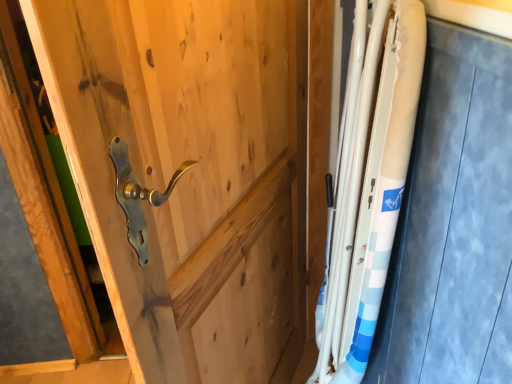
Question: From the image's perspective, would you say white glossy steel at right is positioned over natural wood door handle at center?

Choices:
 (A) yes
 (B) no

Answer: (A)

Question: Is the depth of white glossy steel at right greater than that of natural wood door handle at center?

Choices:
 (A) no
 (B) yes

Answer: (B)

Question: From a real-world perspective, is white glossy steel at right beneath natural wood door handle at center?

Choices:
 (A) no
 (B) yes

Answer: (A)

Question: Does white glossy steel at right have a lesser width compared to natural wood door handle at center?

Choices:
 (A) no
 (B) yes

Answer: (A)

Question: Can you confirm if white glossy steel at right is taller than natural wood door handle at center?

Choices:
 (A) no
 (B) yes

Answer: (A)

Question: Is white glossy steel at right wider than natural wood door handle at center?

Choices:
 (A) yes
 (B) no

Answer: (A)

Question: Considering the relative sizes of natural wood door handle at center and white glossy steel at right in the image provided, is natural wood door handle at center wider than white glossy steel at right?

Choices:
 (A) yes
 (B) no

Answer: (B)

Question: Is natural wood door handle at center at the left side of white glossy steel at right?

Choices:
 (A) no
 (B) yes

Answer: (B)

Question: Does natural wood door handle at center have a lesser width compared to white glossy steel at right?

Choices:
 (A) no
 (B) yes

Answer: (B)

Question: Considering the relative positions of natural wood door handle at center and white glossy steel at right in the image provided, is natural wood door handle at center in front of white glossy steel at right?

Choices:
 (A) yes
 (B) no

Answer: (A)

Question: Is natural wood door handle at center turned away from white glossy steel at right?

Choices:
 (A) yes
 (B) no

Answer: (A)

Question: Can you confirm if natural wood door handle at center is smaller than white glossy steel at right?

Choices:
 (A) no
 (B) yes

Answer: (A)

Question: From the image's perspective, is natural wood door handle at center above or below white glossy steel at right?

Choices:
 (A) above
 (B) below

Answer: (B)